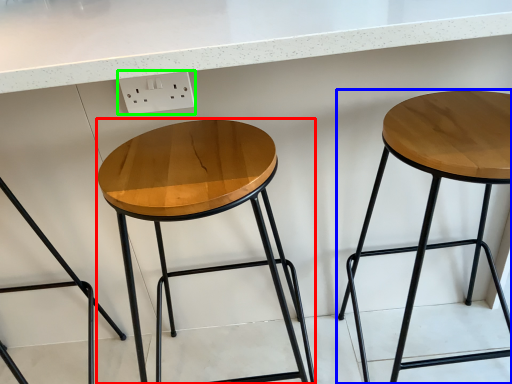
Question: Which is nearer to the stool (highlighted by a red box)? stool (highlighted by a blue box) or electric outlet (highlighted by a green box).

Choices:
 (A) stool
 (B) electric outlet

Answer: (B)